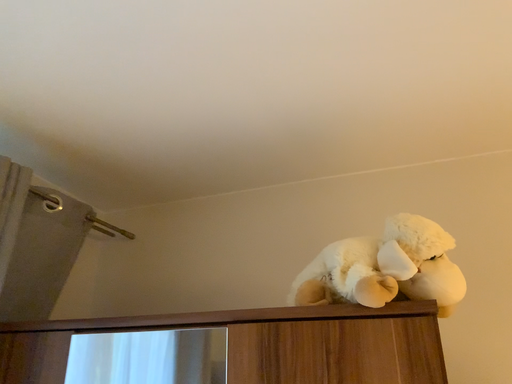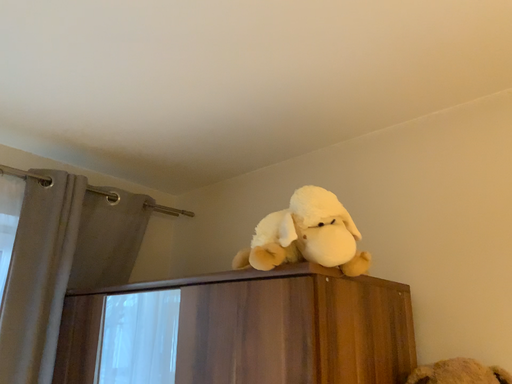
Question: Which way did the camera rotate in the video?

Choices:
 (A) rotated left
 (B) rotated right

Answer: (A)